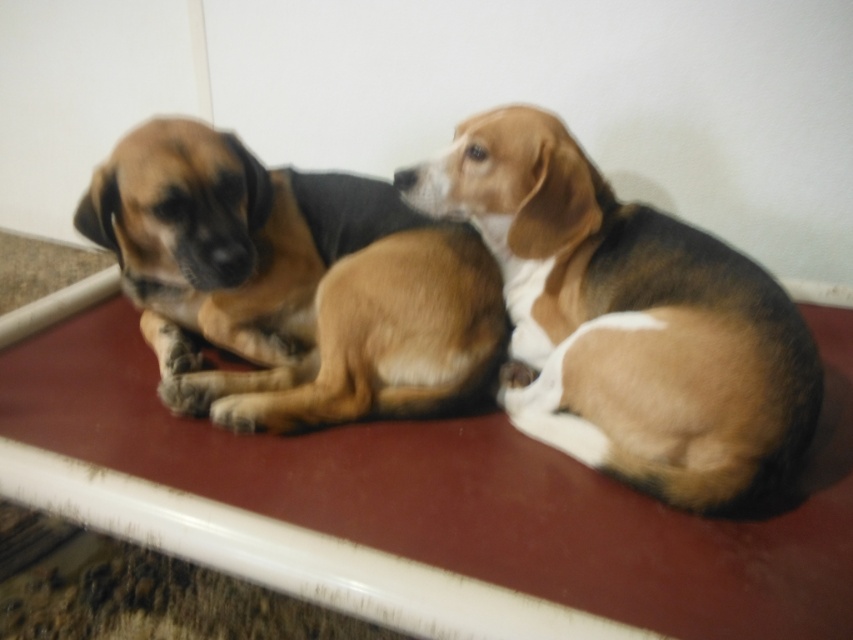
Can you confirm if tri-colored fur dog at center is thinner than brown fur dog at left?

Yes, tri-colored fur dog at center is thinner than brown fur dog at left.

Can you confirm if tri-colored fur dog at center is wider than brown fur dog at left?

Incorrect, tri-colored fur dog at center's width does not surpass brown fur dog at left's.

Which is in front, point (564, 182) or point (125, 141)?

Point (125, 141)

Where is `tri-colored fur dog at center`? Image resolution: width=853 pixels, height=640 pixels. tri-colored fur dog at center is located at coordinates (628, 321).